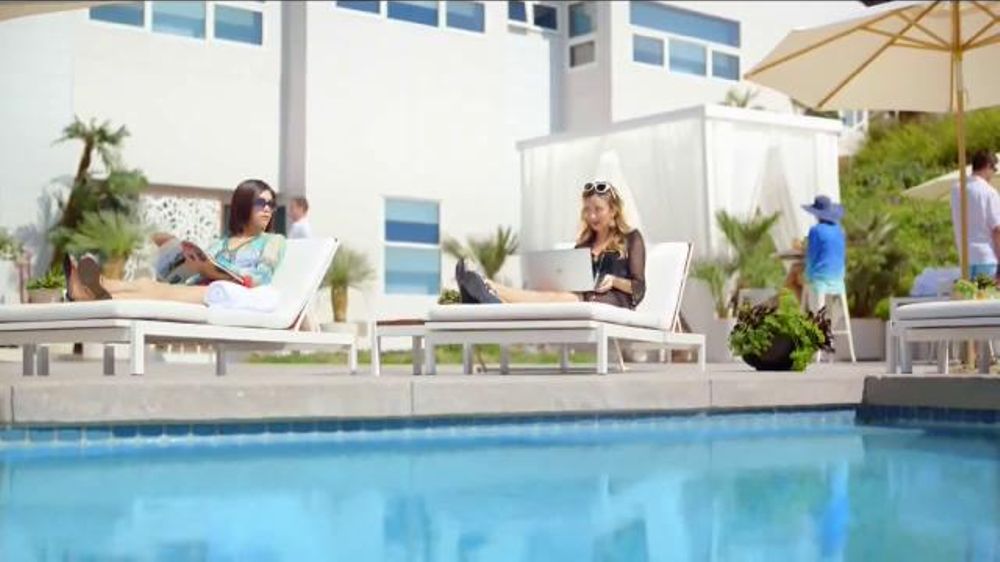
This screenshot has width=1000, height=562. I want to click on chaise lounge, so click(x=170, y=317), click(x=304, y=289), click(x=538, y=310), click(x=670, y=277).